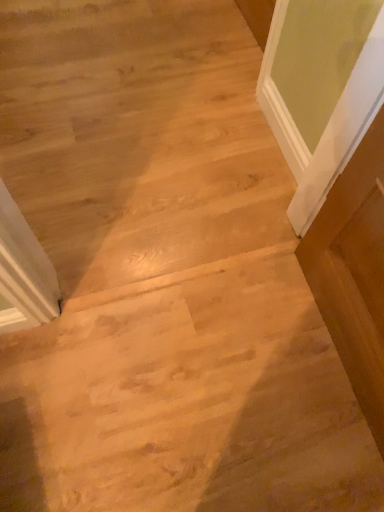
Identify the location of free point below wooden door at right (from a real-world perspective). (334, 368).